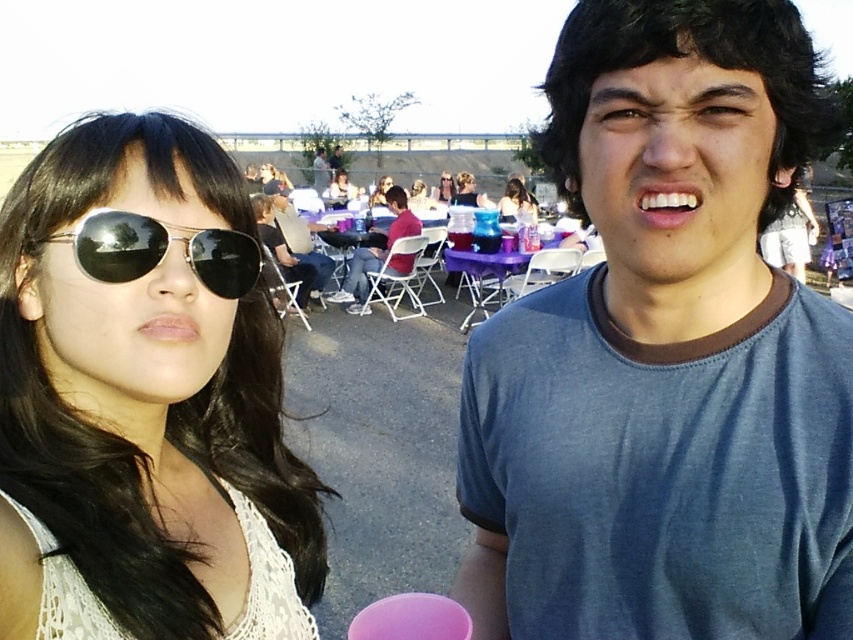
In the scene shown: Can you confirm if matte black shirt at center is bigger than matte black sunglasses at center?

Correct, matte black shirt at center is larger in size than matte black sunglasses at center.

The image size is (853, 640). I want to click on matte black shirt at center, so click(x=297, y=236).

Between point (306, 250) and point (387, 186), which one is positioned behind?

Positioned behind is point (387, 186).

Find the location of a particular element. The width and height of the screenshot is (853, 640). matte black shirt at center is located at coordinates (297, 236).

Who is more forward, (x=525, y=198) or (x=488, y=205)?

Point (x=525, y=198) is in front.

The width and height of the screenshot is (853, 640). I want to click on matte black hair at center, so (515, 200).

I want to click on metallic reflective sunglasses at left, so click(161, 250).

How much distance is there between metallic reflective sunglasses at left and matte black sunglasses at upper center?

A distance of 12.41 meters exists between metallic reflective sunglasses at left and matte black sunglasses at upper center.

Locate an element on the screen. metallic reflective sunglasses at left is located at coordinates (161, 250).

Where is `metallic reflective sunglasses at left`? The image size is (853, 640). metallic reflective sunglasses at left is located at coordinates (161, 250).